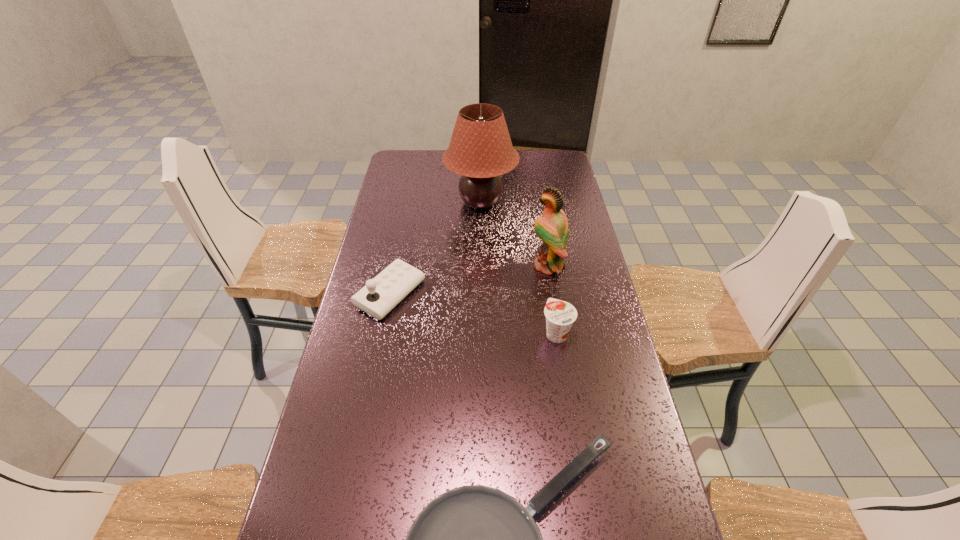
Locate an element on the screen. The height and width of the screenshot is (540, 960). vacant region between the parrot and the farthest object is located at coordinates (515, 234).

I want to click on unoccupied position between the second tallest object and the tallest object, so 515,234.

You are a GUI agent. You are given a task and a screenshot of the screen. Output one action in this format:
    pyautogui.click(x=<x>, y=<y>)
    Task: Click on the free space between the joystick and the lampshade
    The width and height of the screenshot is (960, 540).
    Given the screenshot: What is the action you would take?
    pyautogui.click(x=436, y=248)

Locate an element on the screen. The width and height of the screenshot is (960, 540). unoccupied area between the tallest object and the parrot is located at coordinates (x=515, y=234).

Find the location of a particular element. This screenshot has width=960, height=540. vacant space that is in between the lampshade and the fourth shortest object is located at coordinates (515, 234).

Where is `empty location between the leftmost object and the yogurt`? This screenshot has width=960, height=540. empty location between the leftmost object and the yogurt is located at coordinates (473, 314).

This screenshot has height=540, width=960. Find the location of `the closest object to the leftmost object`. the closest object to the leftmost object is located at coordinates (480, 150).

Point out which object is positioned as the third nearest to the yogurt. Please provide its 2D coordinates. Your answer should be formatted as a tuple, i.e. [(x, y)], where the tuple contains the x and y coordinates of a point satisfying the conditions above.

[(380, 295)]

At what (x,y) coordinates should I click in order to perform the action: click on vacant space that satisfies the following two spatial constraints: 1. on the front-facing side of the lampshade; 2. on the right side of the yogurt. Please return your answer as a coordinate pair (x, y). Looking at the image, I should click on (481, 333).

Where is `free location that satisfies the following two spatial constraints: 1. on the front-facing side of the second shortest object; 2. on the left side of the lampshade`? free location that satisfies the following two spatial constraints: 1. on the front-facing side of the second shortest object; 2. on the left side of the lampshade is located at coordinates (481, 333).